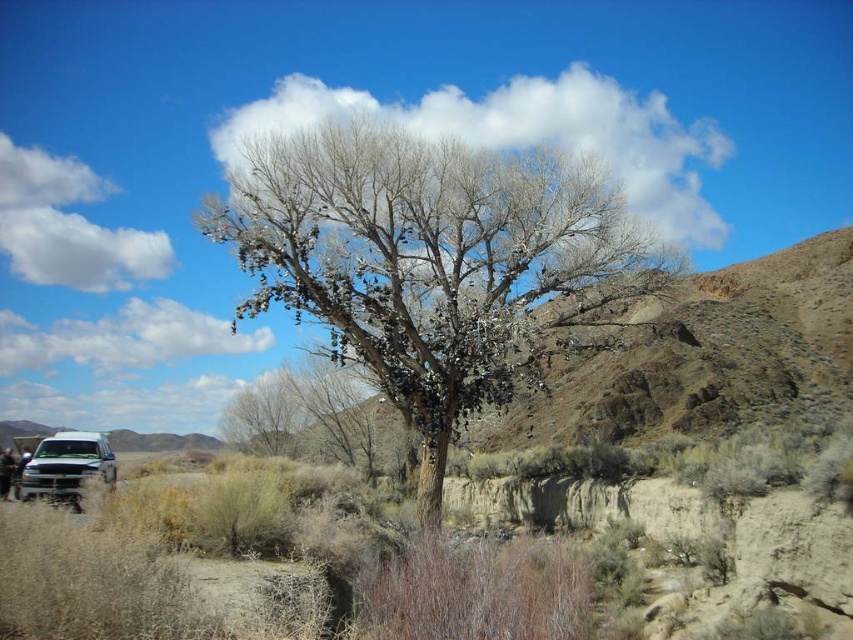
Consider the image. You are a photographer planning to capture the bare branches at center and the gray bark tree at center in a single shot. Based on their sizes, which one would you focus on to ensure both are clearly visible in the frame?

Since the bare branches at center is larger in size than the gray bark tree at center, you should focus on the bare branches at center to ensure both are clearly visible in the frame.

You are a photographer setting up a tripod to capture the gray bark tree at center. You notice the silver metallic truck at lower left in the background. Considering their sizes in the frame, which object would appear bigger in your photo?

The silver metallic truck at lower left would appear bigger in the photo because it is larger in size than the gray bark tree at center.

From the picture: You are a photographer trying to capture a photo of the gray bark tree at center. You notice the silver metallic truck at lower left is blocking part of the tree. Can you determine if the truck is taller than the tree, making it harder to frame the shot?

The silver metallic truck at lower left is much taller than the gray bark tree at center, so it might block more of the tree, making it harder to frame the shot.